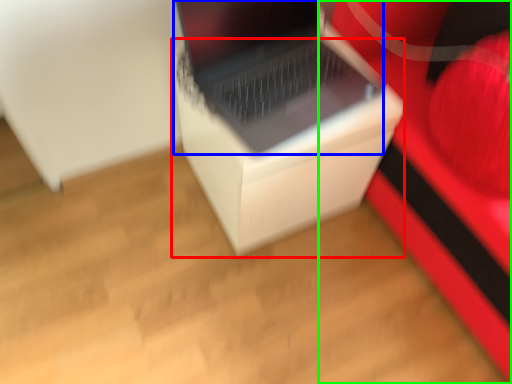
Question: Based on their relative distances, which object is nearer to cardboard box (highlighted by a red box)? Choose from laptop (highlighted by a blue box) and furniture (highlighted by a green box).

Choices:
 (A) laptop
 (B) furniture

Answer: (A)